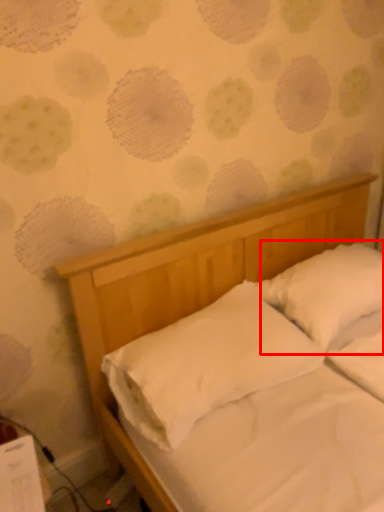
Question: Observing the image, what is the correct spatial positioning of pillow (annotated by the red box) in reference to pillow?

Choices:
 (A) left
 (B) right

Answer: (B)